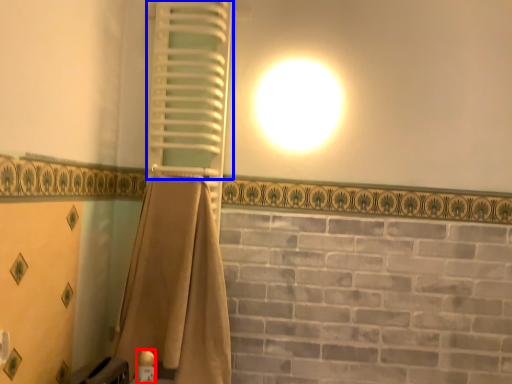
Question: Which of the following is the closest to the observer, toiletry (highlighted by a red box) or shutter (highlighted by a blue box)?

Choices:
 (A) toiletry
 (B) shutter

Answer: (A)